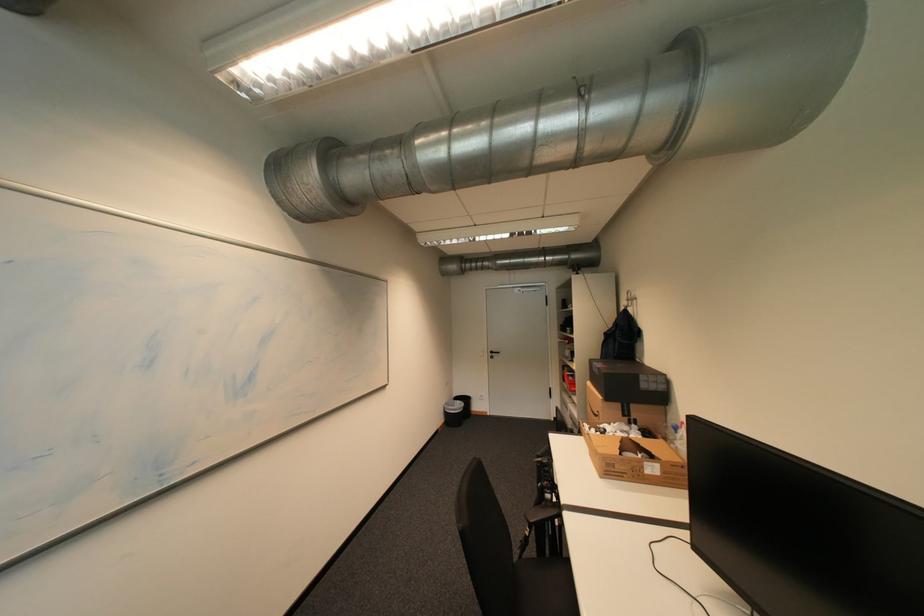
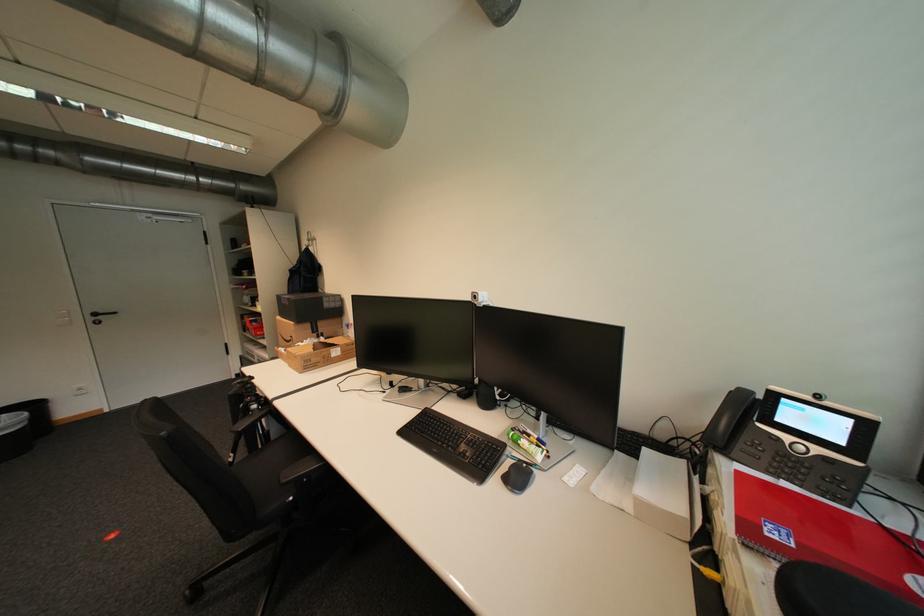
Where in the second image is the point corresponding to point (606, 375) from the first image?

(296, 305)